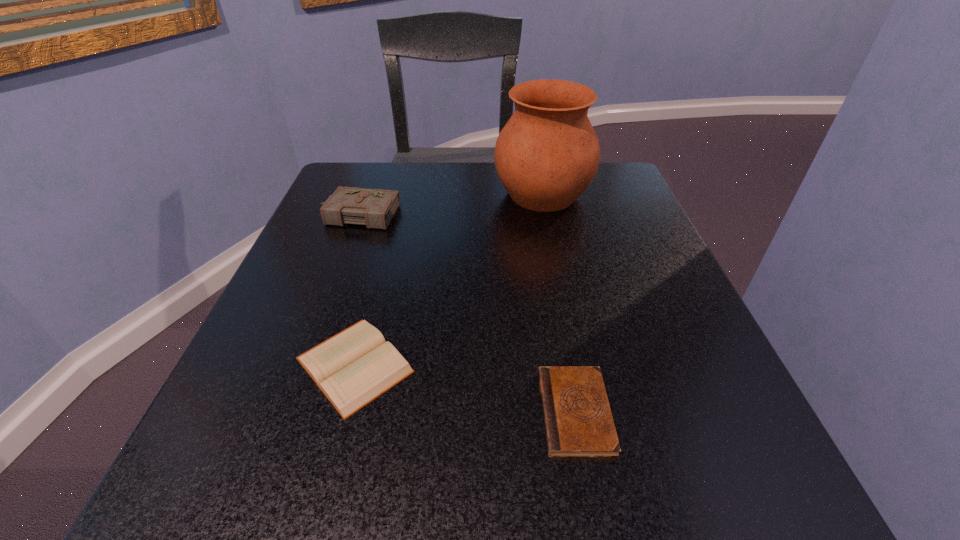
Locate an element on the screen. the tallest object is located at coordinates (547, 154).

In order to click on the farthest diary in this screenshot , I will do `click(375, 208)`.

You are a GUI agent. You are given a task and a screenshot of the screen. Output one action in this format:
    pyautogui.click(x=<x>, y=<y>)
    Task: Click on the second tallest object
    Image resolution: width=960 pixels, height=540 pixels.
    Given the screenshot: What is the action you would take?
    [375, 208]

You are a GUI agent. You are given a task and a screenshot of the screen. Output one action in this format:
    pyautogui.click(x=<x>, y=<y>)
    Task: Click on the second shortest object
    
    Given the screenshot: What is the action you would take?
    pyautogui.click(x=354, y=367)

The height and width of the screenshot is (540, 960). In order to click on the shortest diary in this screenshot , I will do `click(578, 422)`.

This screenshot has height=540, width=960. In order to click on the shortest object in this screenshot , I will do `click(578, 422)`.

This screenshot has height=540, width=960. I want to click on free location located on the front of the tallest object, so click(566, 313).

The image size is (960, 540). In order to click on vacant space located on the front of the third shortest object in this screenshot , I will do `click(304, 354)`.

The image size is (960, 540). I want to click on blank area located 0.100m on the right of the third tallest object, so click(486, 365).

At what (x,y) coordinates should I click in order to perform the action: click on blank space located 0.360m on the spine side of the rightmost diary. Please return your answer as a coordinate pair (x, y). This screenshot has height=540, width=960. Looking at the image, I should click on (265, 412).